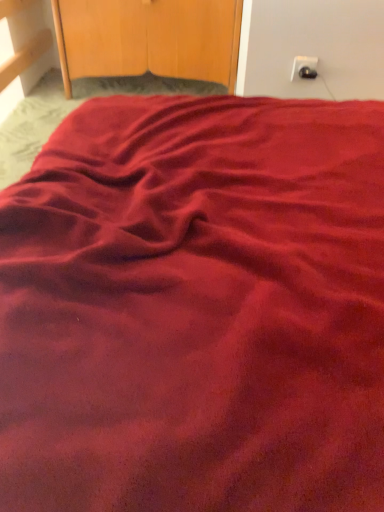
Question: Is black plastic outlet at upper right at the back of wooden dresser at upper center?

Choices:
 (A) no
 (B) yes

Answer: (A)

Question: From a real-world perspective, is wooden dresser at upper center beneath black plastic outlet at upper right?

Choices:
 (A) yes
 (B) no

Answer: (A)

Question: Would you say wooden dresser at upper center is a long distance from black plastic outlet at upper right?

Choices:
 (A) yes
 (B) no

Answer: (B)

Question: From a real-world perspective, is wooden dresser at upper center on black plastic outlet at upper right?

Choices:
 (A) yes
 (B) no

Answer: (B)

Question: Considering the relative sizes of wooden dresser at upper center and black plastic outlet at upper right in the image provided, is wooden dresser at upper center bigger than black plastic outlet at upper right?

Choices:
 (A) no
 (B) yes

Answer: (B)

Question: Can we say wooden dresser at upper center lies outside black plastic outlet at upper right?

Choices:
 (A) yes
 (B) no

Answer: (A)

Question: From a real-world perspective, is black plastic outlet at upper right positioned over wooden dresser at upper center based on gravity?

Choices:
 (A) yes
 (B) no

Answer: (A)

Question: Does black plastic outlet at upper right appear on the left side of wooden dresser at upper center?

Choices:
 (A) no
 (B) yes

Answer: (A)

Question: Can you confirm if black plastic outlet at upper right is taller than wooden dresser at upper center?

Choices:
 (A) yes
 (B) no

Answer: (B)

Question: From the image's perspective, is black plastic outlet at upper right located beneath wooden dresser at upper center?

Choices:
 (A) no
 (B) yes

Answer: (B)

Question: Does black plastic outlet at upper right have a greater width compared to wooden dresser at upper center?

Choices:
 (A) yes
 (B) no

Answer: (B)

Question: Considering the relative sizes of black plastic outlet at upper right and wooden dresser at upper center in the image provided, is black plastic outlet at upper right bigger than wooden dresser at upper center?

Choices:
 (A) yes
 (B) no

Answer: (B)

Question: Considering the relative positions of wooden dresser at upper center and black plastic outlet at upper right in the image provided, is wooden dresser at upper center to the left or to the right of black plastic outlet at upper right?

Choices:
 (A) right
 (B) left

Answer: (B)